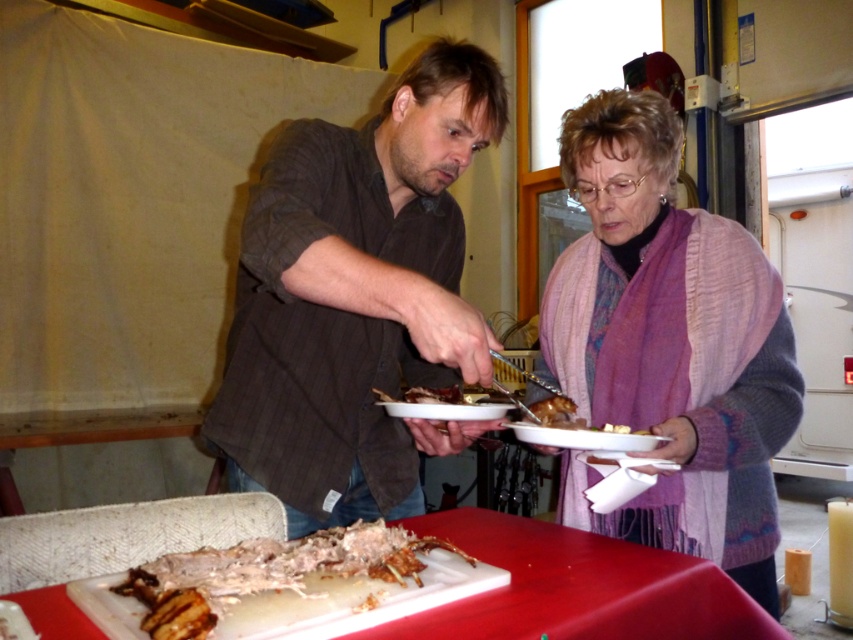
Question: Which point is farther to the camera?

Choices:
 (A) (62, 598)
 (B) (285, 161)
 (C) (761, 310)

Answer: (C)

Question: Where is knitted purple scarf at center located in relation to white plastic cutting board at lower center in the image?

Choices:
 (A) right
 (B) left

Answer: (A)

Question: Can you confirm if matte brown shirt at center is bigger than brown striped shirt at center?

Choices:
 (A) yes
 (B) no

Answer: (A)

Question: Which of the following is the farthest from the observer?

Choices:
 (A) (619, 326)
 (B) (244, 544)
 (C) (547, 616)
 (D) (412, 157)

Answer: (A)

Question: Which point is closer to the camera?

Choices:
 (A) brown striped shirt at center
 (B) grilled meat at center
 (C) knitted purple scarf at center
 (D) white plastic cutting board at lower center

Answer: (B)

Question: Is the position of brown striped shirt at center more distant than that of white plastic cutting board at lower center?

Choices:
 (A) no
 (B) yes

Answer: (B)